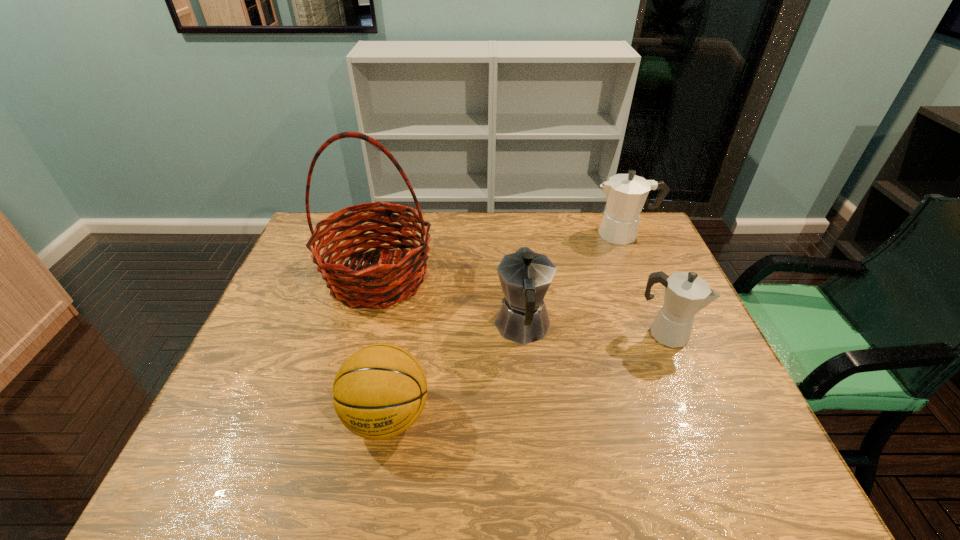
At what (x,y) coordinates should I click in order to perform the action: click on blank space at the right edge of the desktop. Please return your answer as a coordinate pair (x, y). Looking at the image, I should click on (638, 286).

The width and height of the screenshot is (960, 540). What are the coordinates of `free location at the far right corner of the desktop` in the screenshot? It's located at (642, 230).

The image size is (960, 540). In order to click on vacant point located between the third object from right to left and the nearest object in this screenshot , I will do `click(455, 372)`.

At what (x,y) coordinates should I click in order to perform the action: click on vacant area that lies between the tallest object and the leftmost coffeepot. Please return your answer as a coordinate pair (x, y). The image size is (960, 540). Looking at the image, I should click on (450, 302).

You are a GUI agent. You are given a task and a screenshot of the screen. Output one action in this format:
    pyautogui.click(x=<x>, y=<y>)
    Task: Click on the vacant area that lies between the leftmost coffeepot and the tallest object
    
    Given the screenshot: What is the action you would take?
    coord(450,302)

This screenshot has width=960, height=540. Identify the location of vacant space that is in between the farthest coffeepot and the basket. (501, 255).

Select which object is the second closest to the basket. Please provide its 2D coordinates. Your answer should be formatted as a tuple, i.e. [(x, y)], where the tuple contains the x and y coordinates of a point satisfying the conditions above.

[(379, 392)]

Image resolution: width=960 pixels, height=540 pixels. In order to click on object that is the closest to the farthest coffeepot in this screenshot , I will do `click(525, 276)`.

Select which coffeepot appears as the closest to the basketball. Please provide its 2D coordinates. Your answer should be formatted as a tuple, i.e. [(x, y)], where the tuple contains the x and y coordinates of a point satisfying the conditions above.

[(525, 276)]

Locate which coffeepot is the second closest to the third object from left to right. Please provide its 2D coordinates. Your answer should be formatted as a tuple, i.e. [(x, y)], where the tuple contains the x and y coordinates of a point satisfying the conditions above.

[(626, 194)]